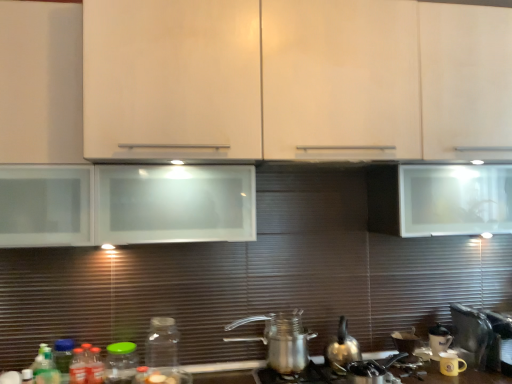
Question: Is green matte bottle at lower left, positioned as the 2th bottle in left-to-right order, beside metallic silver coffee pot at center?

Choices:
 (A) yes
 (B) no

Answer: (B)

Question: Considering the relative sizes of green matte bottle at lower left, which appears as the 4th bottle when viewed from the right, and metallic silver coffee pot at center in the image provided, is green matte bottle at lower left, which appears as the 4th bottle when viewed from the right, shorter than metallic silver coffee pot at center?

Choices:
 (A) yes
 (B) no

Answer: (A)

Question: Does green matte bottle at lower left, which appears as the 4th bottle when viewed from the right, lie in front of metallic silver coffee pot at center?

Choices:
 (A) yes
 (B) no

Answer: (A)

Question: Could you tell me if green matte bottle at lower left, which appears as the 4th bottle when viewed from the right, is turned towards metallic silver coffee pot at center?

Choices:
 (A) yes
 (B) no

Answer: (B)

Question: Is green matte bottle at lower left, positioned as the 2th bottle in left-to-right order, bigger than metallic silver coffee pot at center?

Choices:
 (A) no
 (B) yes

Answer: (A)

Question: In terms of height, does metallic silver toaster at lower right, marked as the 1th appliance in a right-to-left arrangement, look taller or shorter compared to translucent plastic bottle at lower left, the 3th bottle positioned from the left?

Choices:
 (A) short
 (B) tall

Answer: (B)

Question: In the image, is metallic silver toaster at lower right, marked as the 1th appliance in a right-to-left arrangement, positioned in front of or behind translucent plastic bottle at lower left, the 3th bottle positioned from the left?

Choices:
 (A) behind
 (B) front

Answer: (A)

Question: Is point (489, 359) closer or farther from the camera than point (99, 349)?

Choices:
 (A) closer
 (B) farther

Answer: (B)

Question: Is metallic silver toaster at lower right, which is the 3th appliance from left to right, to the left or to the right of translucent plastic bottle at lower left, positioned as the 3th bottle in right-to-left order, in the image?

Choices:
 (A) left
 (B) right

Answer: (B)

Question: Considering the positions of green glass jar at lower left, which appears as the 2th bottle when viewed from the right, and matte white cabinet at center in the image, is green glass jar at lower left, which appears as the 2th bottle when viewed from the right, wider or thinner than matte white cabinet at center?

Choices:
 (A) wide
 (B) thin

Answer: (B)

Question: Is green glass jar at lower left, which appears as the 2th bottle when viewed from the right, in front of or behind matte white cabinet at center in the image?

Choices:
 (A) front
 (B) behind

Answer: (B)

Question: Is point (113, 359) closer or farther from the camera than point (373, 150)?

Choices:
 (A) closer
 (B) farther

Answer: (B)

Question: From the image's perspective, relative to matte white cabinet at center, is green glass jar at lower left, which appears as the 2th bottle when viewed from the right, above or below?

Choices:
 (A) above
 (B) below

Answer: (B)

Question: Considering their positions, is transparent glass jar at lower center, the 1th bottle viewed from the right, located in front of or behind white glossy coffee cup at lower right, acting as the 2th appliance starting from the right?

Choices:
 (A) behind
 (B) front

Answer: (B)

Question: From the image's perspective, relative to white glossy coffee cup at lower right, which is the second appliance from left to right, is transparent glass jar at lower center, acting as the fifth bottle starting from the left, above or below?

Choices:
 (A) below
 (B) above

Answer: (B)